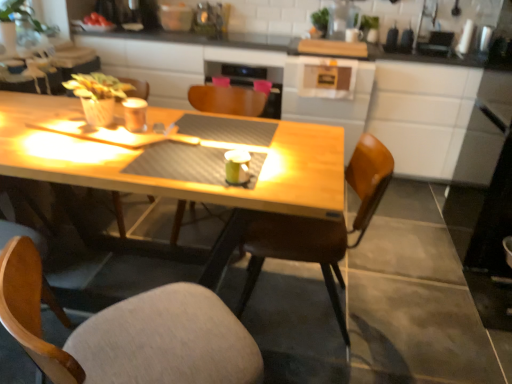
Question: Does brown leather chair at center, placed as the 2th chair when sorted from front to back, have a greater height compared to wooden chair at center, arranged as the third chair when viewed from the front?

Choices:
 (A) no
 (B) yes

Answer: (B)

Question: Is brown leather chair at center, placed as the 2th chair when sorted from front to back, thinner than wooden chair at center, arranged as the third chair when viewed from the front?

Choices:
 (A) no
 (B) yes

Answer: (B)

Question: From a real-world perspective, is brown leather chair at center, placed as the 2th chair when sorted from front to back, under wooden chair at center, the first chair in the back-to-front sequence?

Choices:
 (A) no
 (B) yes

Answer: (A)

Question: Does brown leather chair at center, placed as the 2th chair when sorted from front to back, come in front of wooden chair at center, the first chair in the back-to-front sequence?

Choices:
 (A) yes
 (B) no

Answer: (A)

Question: Is brown leather chair at center, placed as the 2th chair when sorted from front to back, positioned with its back to wooden chair at center, the first chair in the back-to-front sequence?

Choices:
 (A) no
 (B) yes

Answer: (A)

Question: Considering the relative positions of green leafy plant at upper left and matte metallic cup at center, marked as the first coffee cup in a back-to-front arrangement, in the image provided, is green leafy plant at upper left to the left or to the right of matte metallic cup at center, marked as the first coffee cup in a back-to-front arrangement,?

Choices:
 (A) right
 (B) left

Answer: (B)

Question: From the image's perspective, relative to matte metallic cup at center, placed as the 2th coffee cup when sorted from front to back, is green leafy plant at upper left above or below?

Choices:
 (A) below
 (B) above

Answer: (B)

Question: Is green leafy plant at upper left bigger or smaller than matte metallic cup at center, arranged as the second coffee cup when ordered from the bottom?

Choices:
 (A) small
 (B) big

Answer: (B)

Question: Is green leafy plant at upper left spatially inside matte metallic cup at center, the 1th coffee cup from the left, or outside of it?

Choices:
 (A) outside
 (B) inside

Answer: (A)

Question: Looking at the image, does matte metallic cup at center, which is the first coffee cup from top to bottom, seem bigger or smaller compared to green leafy plant at upper left?

Choices:
 (A) big
 (B) small

Answer: (B)

Question: Considering the positions of matte metallic cup at center, marked as the first coffee cup in a back-to-front arrangement, and green leafy plant at upper left in the image, is matte metallic cup at center, marked as the first coffee cup in a back-to-front arrangement, taller or shorter than green leafy plant at upper left?

Choices:
 (A) short
 (B) tall

Answer: (A)

Question: Is point (142, 117) closer or farther from the camera than point (49, 24)?

Choices:
 (A) farther
 (B) closer

Answer: (B)

Question: Is matte metallic cup at center, the 1th coffee cup from the left, situated inside green leafy plant at upper left or outside?

Choices:
 (A) outside
 (B) inside

Answer: (A)

Question: Is matte metallic cup at center, arranged as the second coffee cup when ordered from the bottom, taller or shorter than green matte mug at center, which is the second coffee cup from top to bottom?

Choices:
 (A) short
 (B) tall

Answer: (B)

Question: Considering their positions, is matte metallic cup at center, arranged as the second coffee cup when ordered from the bottom, located in front of or behind green matte mug at center, which is the first coffee cup in bottom-to-top order?

Choices:
 (A) front
 (B) behind

Answer: (B)